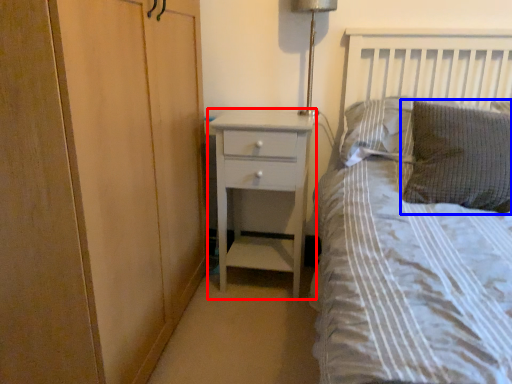
Question: Which object appears farthest to the camera in this image, chest of drawers (highlighted by a red box) or pillow (highlighted by a blue box)?

Choices:
 (A) chest of drawers
 (B) pillow

Answer: (A)